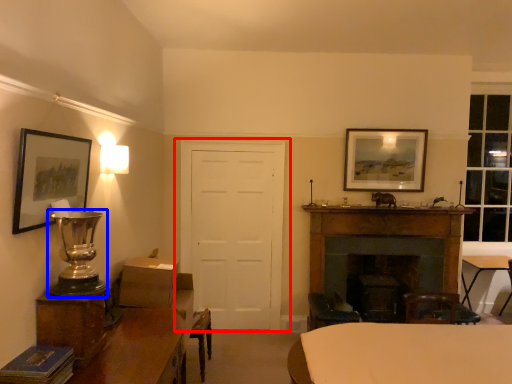
Question: Which object appears closest to the camera in this image, door (highlighted by a red box) or table lamp (highlighted by a blue box)?

Choices:
 (A) door
 (B) table lamp

Answer: (B)